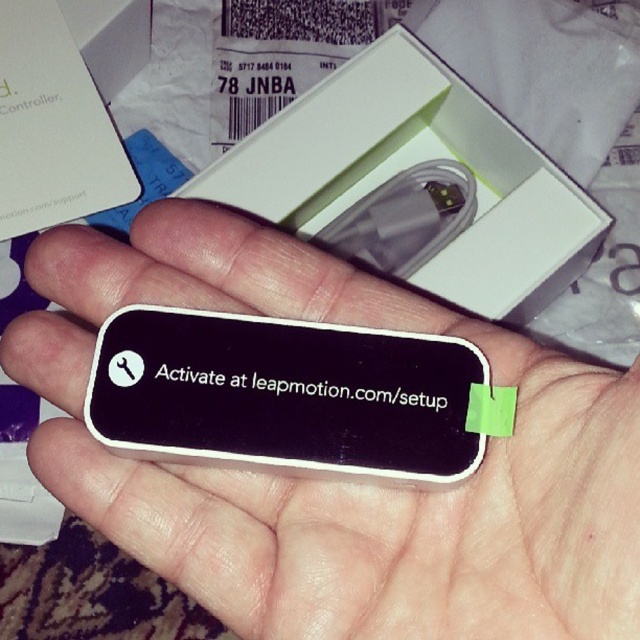
You are organizing a delivery and need to place the white matte box at center and the black matte text at center into a storage container. Which object should you place first to ensure the one closer to you is on top?

You should place the black matte text at center first because the white matte box at center is closer to you, so placing the box on top will maintain its position closer to you.

You are holding a black matte card at center and want to place it on the open white box in the background. Can you reach the box without moving your current position?

The black matte card at center is 53.69 centimeters from the viewer. Since the box is in the background, it is farther away than the card. Therefore, you cannot reach the box without moving your current position.